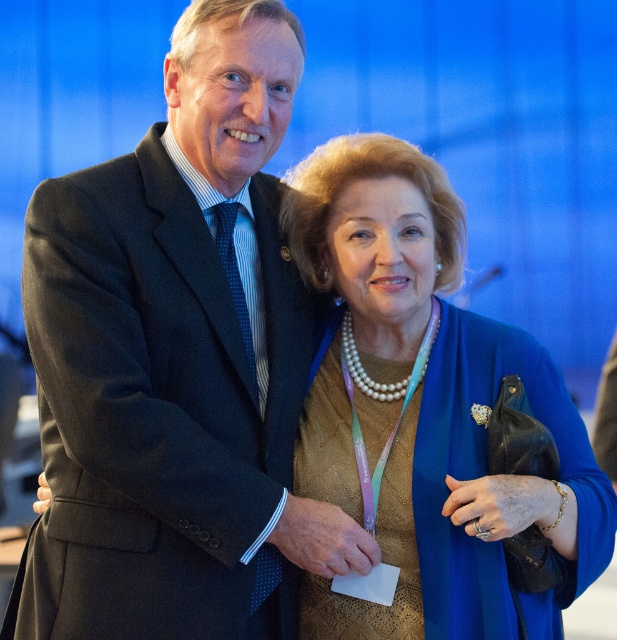
You are a photographer at an event and need to position a light source at point (173,358). Which object in the scene is exactly at that point?

The dark gray suit at center is located at point (173,358).

You are standing 10 feet away from the image. A point at coordinates point (424, 408) is part of the scene. If you want to touch this point, will you be able to reach it without moving closer?

The distance of point (424, 408) from viewer is 7.95 feet. Since you are 10 feet away from the image, you are farther than the point. You would need to move closer to reach it.